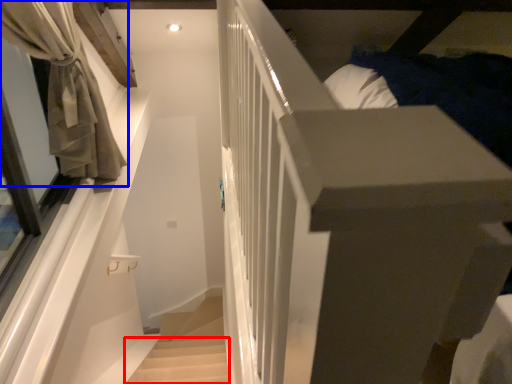
Question: Which point is closer to the camera, stairwell (highlighted by a red box) or curtain (highlighted by a blue box)?

Choices:
 (A) stairwell
 (B) curtain

Answer: (B)